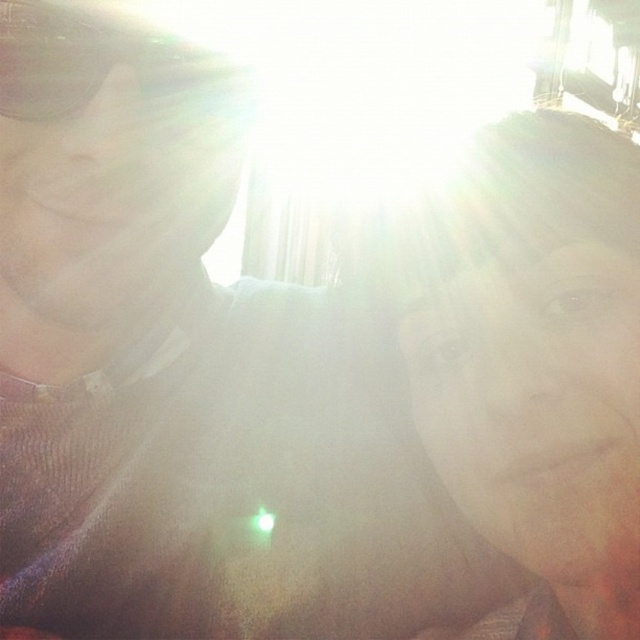
Which is below, smooth skin face at right or matte black goggles at upper left?

smooth skin face at right is lower down.

In the scene shown: Can you confirm if smooth skin face at right is positioned to the right of matte black goggles at upper left?

Indeed, smooth skin face at right is positioned on the right side of matte black goggles at upper left.

Between point (512, 241) and point (40, 120), which one is positioned behind?

The point (512, 241) is behind.

Locate an element on the screen. smooth skin face at right is located at coordinates point(531,353).